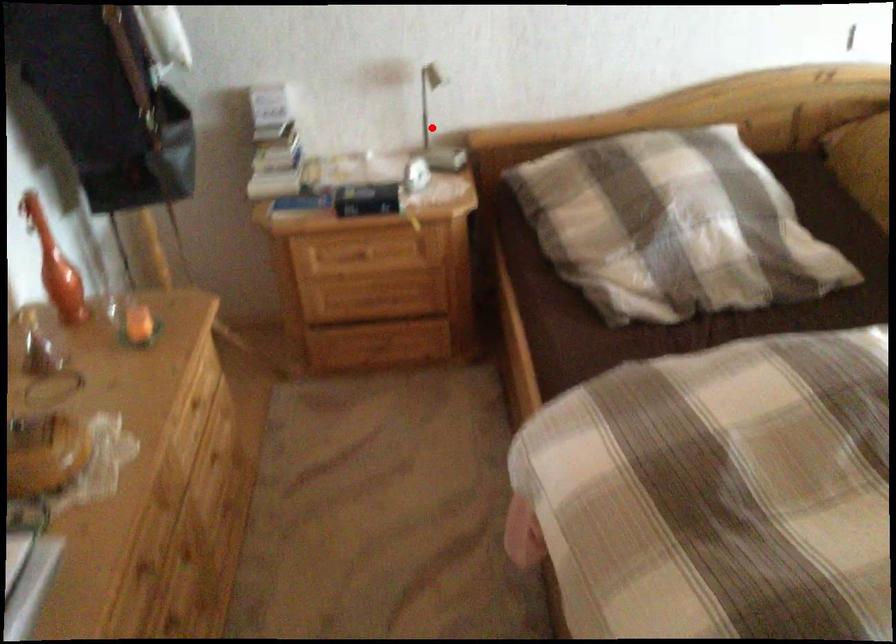
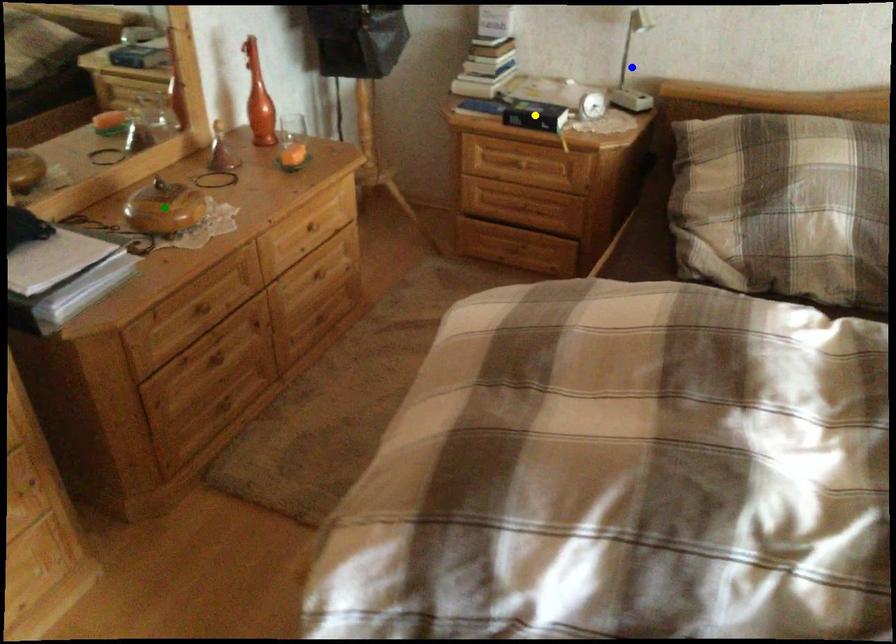
Question: I am providing you with two images of the same scene from different viewpoints. A red point is marked on the first image. You are given multiple points on the second image. Which mark in image 2 goes with the point in image 1?

Choices:
 (A) green point
 (B) blue point
 (C) yellow point

Answer: (B)